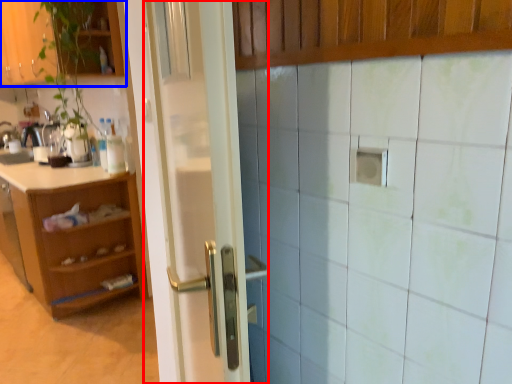
Question: Among these objects, which one is nearest to the camera, door (highlighted by a red box) or cabinetry (highlighted by a blue box)?

Choices:
 (A) door
 (B) cabinetry

Answer: (A)